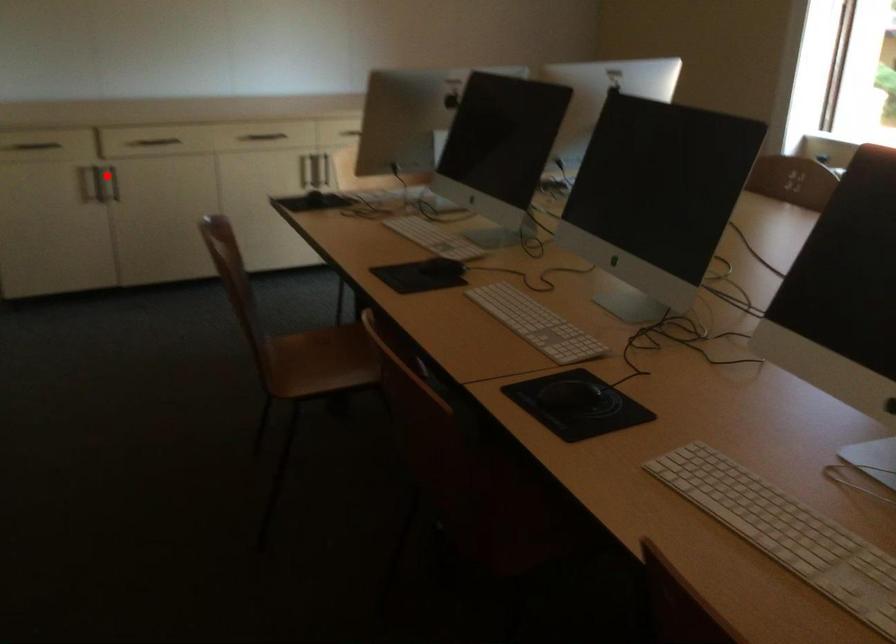
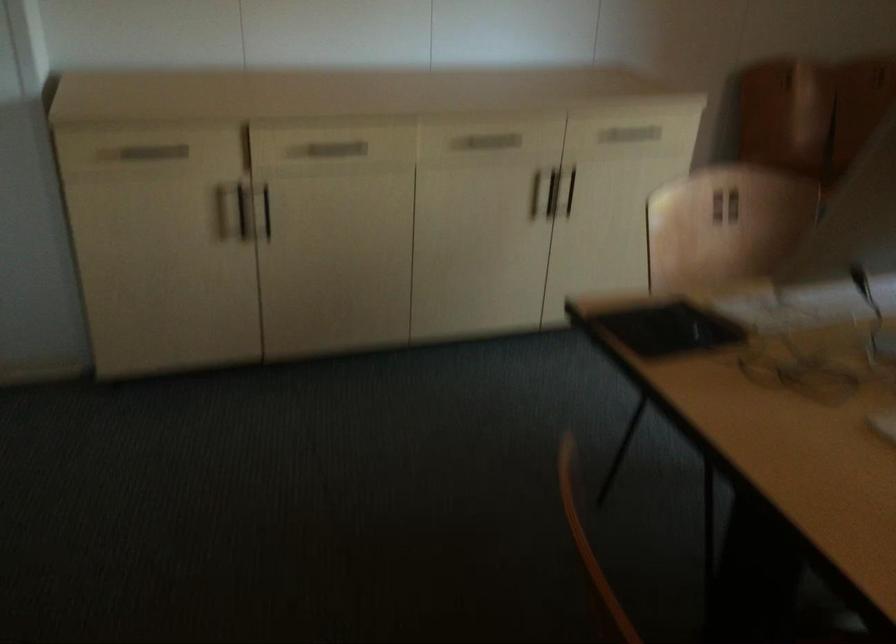
Question: A red point is marked in image1. In image2, is the corresponding 3D point closer to the camera or farther? Reply with the corresponding letter.

Choices:
 (A) The corresponding 3D point is closer.
 (B) The corresponding 3D point is farther.

Answer: (A)